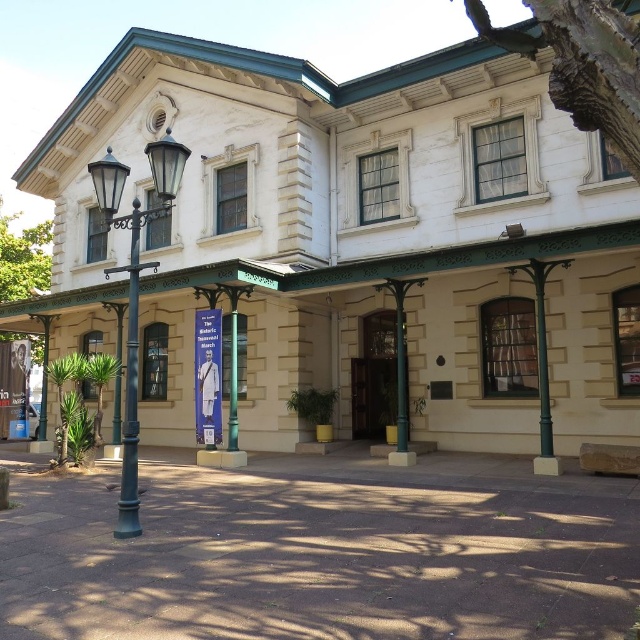
Question: Which object is positioned farthest from the beige stone building at center?

Choices:
 (A) green metal/texture lamp post at left
 (B) polished metal streetlamp at left
 (C) green metal/texture pillar at center

Answer: (C)

Question: Does green metal/texture lamp post at left appear on the left side of green metal/texture pillar at center?

Choices:
 (A) no
 (B) yes

Answer: (B)

Question: Based on their relative distances, which object is farther from the green metal/texture lamp post at left?

Choices:
 (A) green metal/texture pillar at center
 (B) polished metal streetlamp at left
 (C) beige stone building at center

Answer: (A)

Question: Which point appears farthest from the camera in this image?

Choices:
 (A) (136, 346)
 (B) (76, 259)
 (C) (397, 348)
 (D) (109, 209)

Answer: (B)

Question: Does green metal/texture lamp post at left appear under polished metal streetlamp at left?

Choices:
 (A) no
 (B) yes

Answer: (A)

Question: Does beige stone building at center appear under green metal/texture lamp post at left?

Choices:
 (A) yes
 (B) no

Answer: (B)